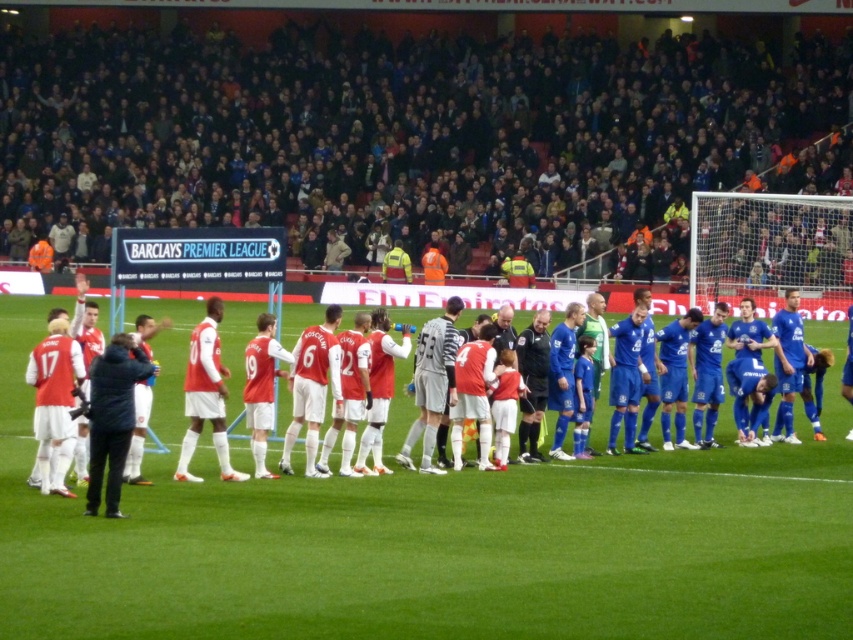
You are a photographer at the Barclays Premier League match. You notice the black fabric jacket at left and the matte gray jersey at center in your viewfinder. Which object is closer to your camera lens?

The black fabric jacket at left is closer to your camera lens because it is in front of the matte gray jersey at center.

You are a photographer standing behind the players and want to capture both the matte red jersey at center and the matte gray jersey at center in your shot. Which jersey will appear larger in your photo?

The matte red jersey at center will appear larger in the photo because it is bigger than the matte gray jersey at center.